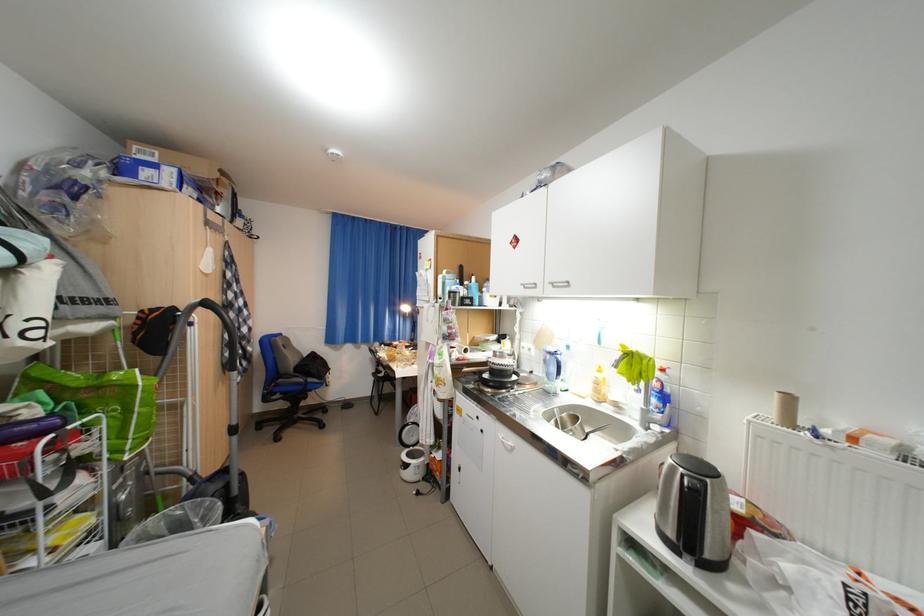
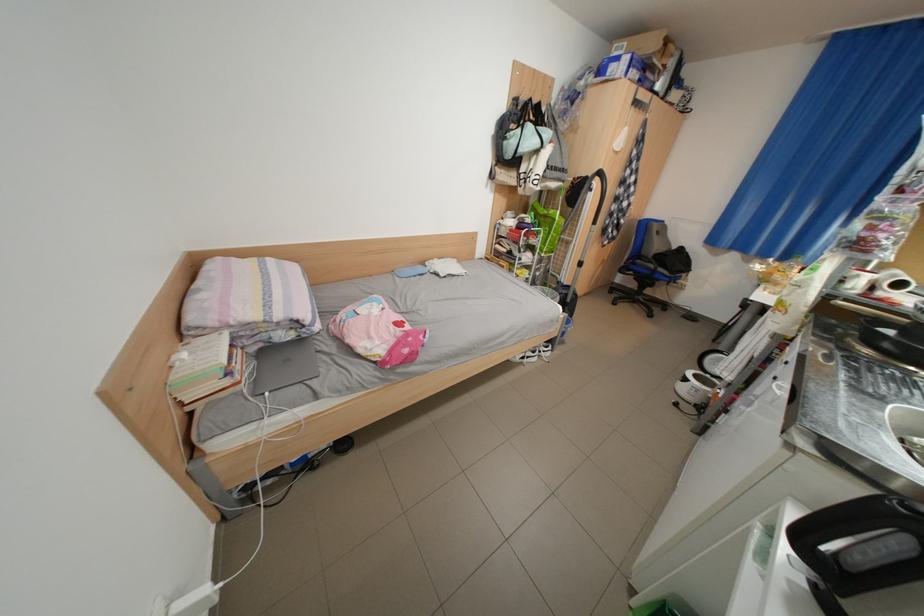
Find the pixel in the second image that matches pixel 288 387 in the first image.

(646, 265)